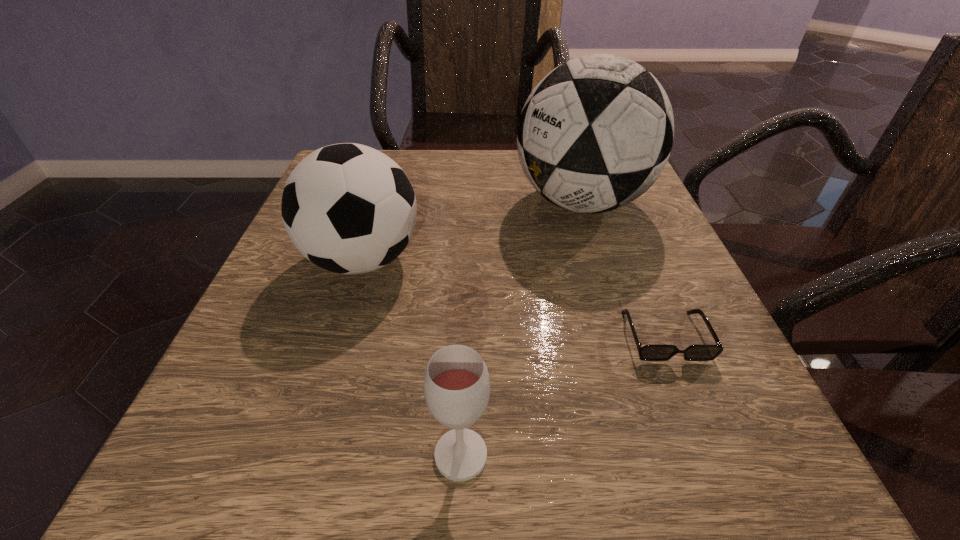
In order to click on free space at the far edge of the desktop in this screenshot , I will do `click(446, 179)`.

I want to click on free point at the near edge, so click(x=371, y=495).

I want to click on blank space at the left edge of the desktop, so click(x=276, y=341).

This screenshot has height=540, width=960. I want to click on blank area at the right edge, so click(x=683, y=420).

Find the location of a particular element. unoccupied position between the wineglass and the shorter soccer ball is located at coordinates (412, 357).

Locate an element on the screen. free point between the leftmost object and the taller soccer ball is located at coordinates (472, 231).

The width and height of the screenshot is (960, 540). I want to click on unoccupied position between the second shortest object and the second tallest object, so click(x=412, y=357).

Where is `free space that is in between the wineglass and the right soccer ball`? free space that is in between the wineglass and the right soccer ball is located at coordinates tap(521, 329).

Find the location of `vacant area that lies between the sunglasses and the right soccer ball`. vacant area that lies between the sunglasses and the right soccer ball is located at coordinates (623, 269).

Identify the location of vacant point located between the leftmost object and the taller soccer ball. (472, 231).